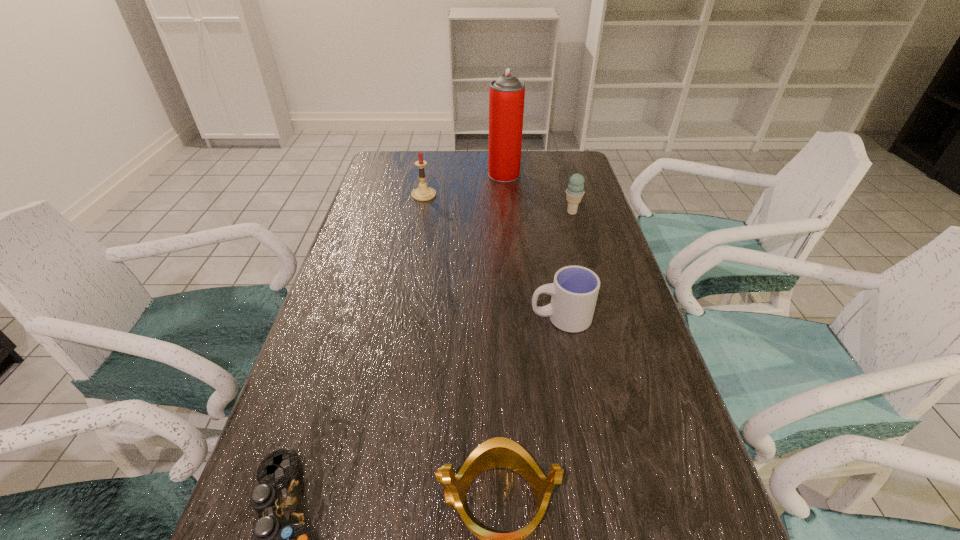
Where is `free region located with the handle on the side of the fourth farthest object`? The image size is (960, 540). free region located with the handle on the side of the fourth farthest object is located at coordinates (436, 318).

Where is `vacant region located with the handle on the side of the fourth farthest object`? The width and height of the screenshot is (960, 540). vacant region located with the handle on the side of the fourth farthest object is located at coordinates (393, 318).

Identify the location of object that is positioned at the far edge. (507, 93).

Where is `object that is at the left edge`? object that is at the left edge is located at coordinates (423, 193).

Locate an element on the screen. ice cream located at the right edge is located at coordinates (574, 193).

In order to click on cup at the right edge in this screenshot , I will do `click(574, 292)`.

You are a GUI agent. You are given a task and a screenshot of the screen. Output one action in this format:
    pyautogui.click(x=<x>, y=<y>)
    Task: Click on the vacant space at the far edge of the desktop
    
    Given the screenshot: What is the action you would take?
    pyautogui.click(x=425, y=172)

The height and width of the screenshot is (540, 960). Identify the location of vacant space at the left edge of the desktop. (385, 300).

Locate an element on the screen. This screenshot has width=960, height=540. vacant space at the right edge is located at coordinates (722, 513).

Find the location of a particular element. This screenshot has width=960, height=540. vacant region at the far left corner is located at coordinates (389, 163).